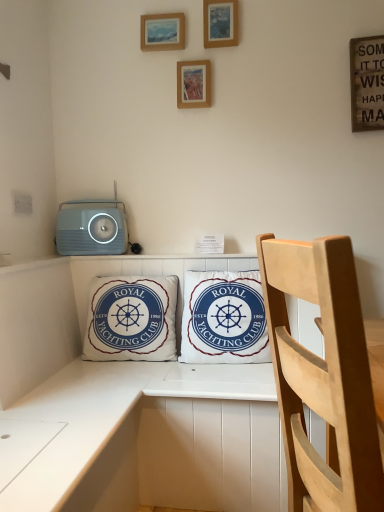
Question: Is white cotton cushion at center, arranged as the 2th pillow when viewed from the right, wider or thinner than wooden picture frame at upper center, positioned as the 2th picture frame in bottom-to-top order?

Choices:
 (A) thin
 (B) wide

Answer: (B)

Question: From the image's perspective, is white cotton cushion at center, the 1th pillow in the left-to-right sequence, positioned above or below wooden picture frame at upper center, which is the 1th picture frame in left-to-right order?

Choices:
 (A) above
 (B) below

Answer: (B)

Question: Estimate the real-world distances between objects in this image. Which object is farther from the wooden picture frame at upper center, the first picture frame when ordered from bottom to top?

Choices:
 (A) white cotton cushion at center, arranged as the 2th pillow when viewed from the right
 (B) light wood chair at right
 (C) wooden picture frame at upper center, the 3th picture frame when ordered from bottom to top
 (D) white cotton pillow at center, the 1th pillow from the right
 (E) matte gray stereo at upper left

Answer: (B)

Question: Estimate the real-world distances between objects in this image. Which object is farther from the wooden picture frame at upper center, the first picture frame when ordered from bottom to top?

Choices:
 (A) white cotton cushion at center, the 1th pillow in the left-to-right sequence
 (B) matte gray stereo at upper left
 (C) light wood chair at right
 (D) wooden picture frame at upper center, which is the 1th picture frame in left-to-right order
 (E) wooden picture frame at upper center, arranged as the 1th picture frame when viewed from the right

Answer: (C)